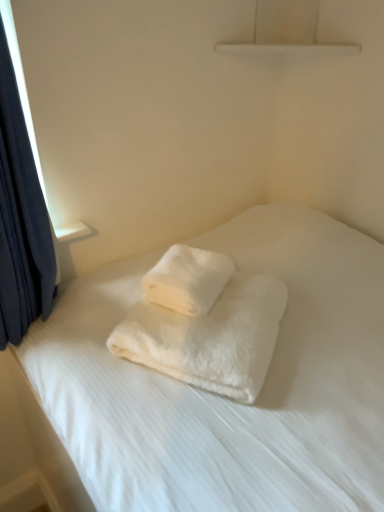
Image resolution: width=384 pixels, height=512 pixels. Identify the location of vacant point above white fluffy towel at center, which ranks as the 2th towel in bottom-to-top order (from a real-world perspective). (196, 264).